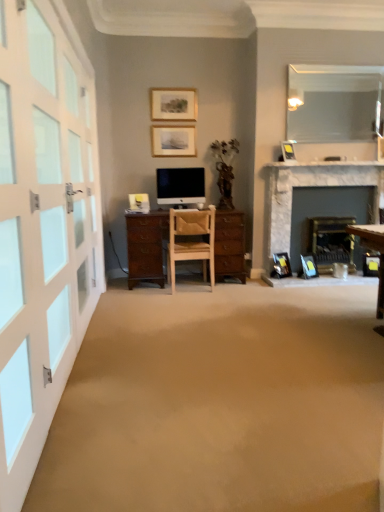
Question: Is blue plastic picture frame at lower right, arranged as the 5th picture frame when viewed from the left, in front of or behind matte black picture frame at upper center, which is the third picture frame in top-to-bottom order, in the image?

Choices:
 (A) behind
 (B) front

Answer: (A)

Question: Considering the positions of blue plastic picture frame at lower right, which is the 5th picture frame from top to bottom, and matte black picture frame at upper center, which is the third picture frame in top-to-bottom order, in the image, is blue plastic picture frame at lower right, which is the 5th picture frame from top to bottom, wider or thinner than matte black picture frame at upper center, which is the third picture frame in top-to-bottom order,?

Choices:
 (A) thin
 (B) wide

Answer: (B)

Question: Considering the real-world distances, which object is closest to the white glass door at left?

Choices:
 (A) matte black picture frame at lower right, which appears as the fourth picture frame when viewed from the top
 (B) marble fireplace at right
 (C) matte wooden picture frame at upper center, arranged as the 1th picture frame when viewed from the top
 (D) blue plastic picture frame at lower right, which appears as the first picture frame when viewed from the right
 (E) matte black monitor at center

Answer: (E)

Question: Which is farther from the matte black picture frame at lower right, which appears as the fourth picture frame when viewed from the top?

Choices:
 (A) clear glass mirror at upper right
 (B) marble fireplace at right
 (C) blue plastic picture frame at lower right, which appears as the first picture frame when viewed from the right
 (D) matte black picture frame at upper center, placed as the 3th picture frame when sorted from bottom to top
 (E) white glass door at left

Answer: (A)